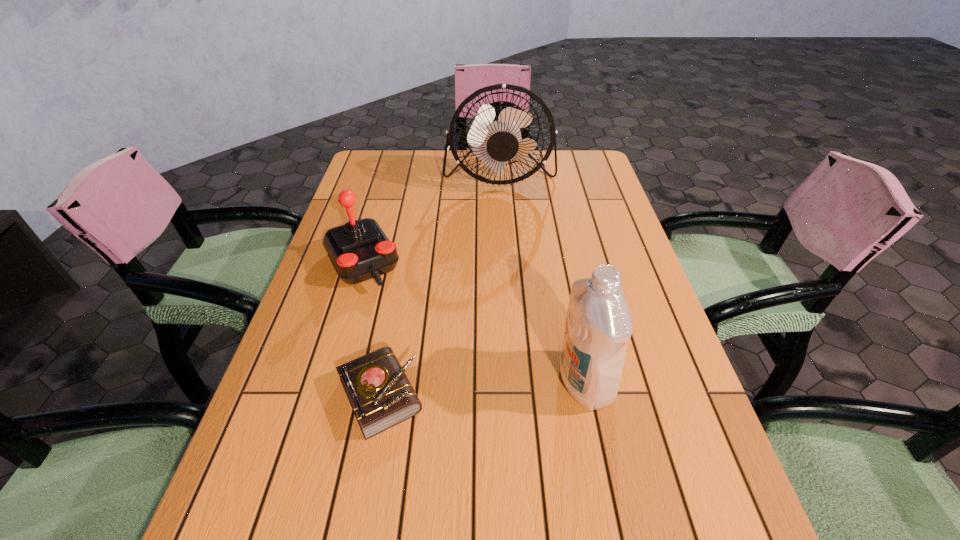
This screenshot has width=960, height=540. I want to click on vacant space in between the fan and the diary, so click(x=440, y=285).

Image resolution: width=960 pixels, height=540 pixels. What are the coordinates of `free space between the fan and the third nearest object` in the screenshot? It's located at (431, 219).

Where is `vacant region between the fan and the third tallest object`? vacant region between the fan and the third tallest object is located at coordinates (431, 219).

Identify the location of free spot between the detergent and the joystick. The width and height of the screenshot is (960, 540). (473, 322).

Locate an element on the screen. Image resolution: width=960 pixels, height=540 pixels. vacant space that's between the detergent and the farthest object is located at coordinates (542, 279).

Where is `free space between the shortest object and the detergent`? free space between the shortest object and the detergent is located at coordinates (482, 389).

The width and height of the screenshot is (960, 540). I want to click on free space between the farthest object and the diary, so click(x=440, y=285).

Where is `vacant space that's between the diary and the second farthest object`? vacant space that's between the diary and the second farthest object is located at coordinates (372, 329).

What are the coordinates of `vacant space that is in between the joystick and the detergent` in the screenshot? It's located at (473, 322).

Where is `the closest object to the shortest object`? the closest object to the shortest object is located at coordinates (359, 250).